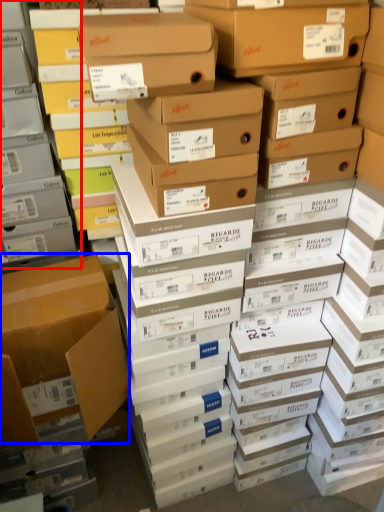
Question: Which of the following is the closest to the observer, shelf (highlighted by a red box) or box (highlighted by a blue box)?

Choices:
 (A) shelf
 (B) box

Answer: (A)